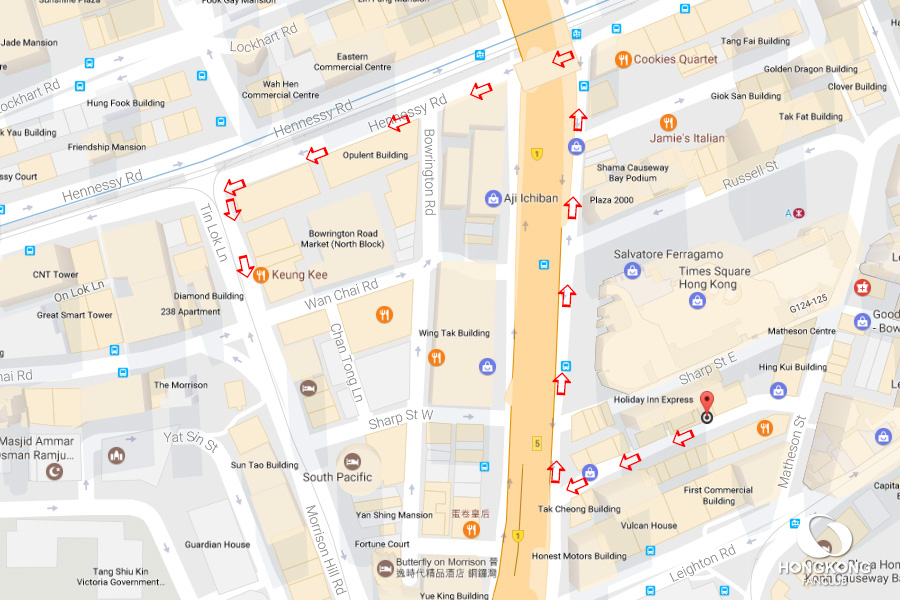
What are the coordinates of `hotels` in the screenshot? It's located at (315, 391), (360, 465), (382, 566), (707, 414).